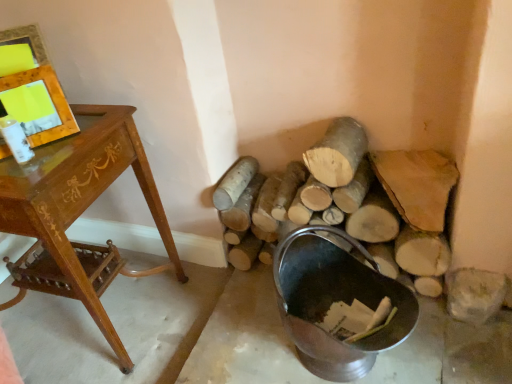
Locate an element on the screen. This screenshot has width=512, height=384. wooden frame at upper left is located at coordinates (51, 99).

What do you see at coordinates (337, 152) in the screenshot?
I see `natural wood log at center, marked as the 2th log in a left-to-right arrangement` at bounding box center [337, 152].

Describe the element at coordinates (234, 183) in the screenshot. I see `natural wood log at center, marked as the 1th log in a left-to-right arrangement` at that location.

Find the location of a particular element. The image size is (512, 384). wooden frame at upper left is located at coordinates (51, 99).

From a real-world perspective, relative to wooden frame at upper left, is natural wood log at center, positioned as the 2th log in right-to-left order, vertically above or below?

Clearly, from a real-world perspective, natural wood log at center, positioned as the 2th log in right-to-left order, is below wooden frame at upper left.

Does natural wood log at center, marked as the 1th log in a left-to-right arrangement, have a greater height compared to wooden frame at upper left?

No, natural wood log at center, marked as the 1th log in a left-to-right arrangement, is not taller than wooden frame at upper left.

Is natural wood log at center, positioned as the 2th log in right-to-left order, directly adjacent to wooden frame at upper left?

No, natural wood log at center, positioned as the 2th log in right-to-left order, is not next to wooden frame at upper left.

Looking at their sizes, would you say natural wood log at center, marked as the 1th log in a left-to-right arrangement, is wider or thinner than wooden frame at upper left?

In the image, natural wood log at center, marked as the 1th log in a left-to-right arrangement, appears to be wider than wooden frame at upper left.

Considering the positions of objects natural wood log at center, positioned as the 2th log in right-to-left order, and natural wood log at center, arranged as the 1th log when viewed from the right, in the image provided, who is more to the left, natural wood log at center, positioned as the 2th log in right-to-left order, or natural wood log at center, arranged as the 1th log when viewed from the right,?

natural wood log at center, positioned as the 2th log in right-to-left order, is more to the left.

Does point (234, 165) lie in front of point (331, 135)?

No.

Is natural wood log at center, marked as the 1th log in a left-to-right arrangement, wider than natural wood log at center, arranged as the 1th log when viewed from the right?

Yes, natural wood log at center, marked as the 1th log in a left-to-right arrangement, is wider than natural wood log at center, arranged as the 1th log when viewed from the right.

From a real-world perspective, is metallic bucket at lower right physically below natural wood log at center, positioned as the 2th log in right-to-left order?

Correct, in the physical world, metallic bucket at lower right is lower than natural wood log at center, positioned as the 2th log in right-to-left order.

Is metallic bucket at lower right situated inside natural wood log at center, positioned as the 2th log in right-to-left order, or outside?

metallic bucket at lower right is spatially situated outside natural wood log at center, positioned as the 2th log in right-to-left order.

From the image's perspective, which object appears higher, metallic bucket at lower right or natural wood log at center, marked as the 1th log in a left-to-right arrangement?

natural wood log at center, marked as the 1th log in a left-to-right arrangement.

Considering the relative positions of metallic bucket at lower right and natural wood log at center, marked as the 1th log in a left-to-right arrangement, in the image provided, is metallic bucket at lower right to the right of natural wood log at center, marked as the 1th log in a left-to-right arrangement, from the viewer's perspective?

Yes.

Can you confirm if wooden frame at upper left is positioned to the left of natural wood log at center, marked as the 1th log in a left-to-right arrangement?

Yes.

Considering the sizes of wooden frame at upper left and natural wood log at center, positioned as the 2th log in right-to-left order, in the image, is wooden frame at upper left taller or shorter than natural wood log at center, positioned as the 2th log in right-to-left order,?

In the image, wooden frame at upper left appears to be taller than natural wood log at center, positioned as the 2th log in right-to-left order.

Considering the sizes of wooden frame at upper left and natural wood log at center, positioned as the 2th log in right-to-left order, in the image, is wooden frame at upper left wider or thinner than natural wood log at center, positioned as the 2th log in right-to-left order,?

wooden frame at upper left is thinner than natural wood log at center, positioned as the 2th log in right-to-left order.

In the scene shown: Is the surface of natural wood log at center, marked as the 1th log in a left-to-right arrangement, in direct contact with metallic bucket at lower right?

No, natural wood log at center, marked as the 1th log in a left-to-right arrangement, is not next to metallic bucket at lower right.

From the image's perspective, between natural wood log at center, positioned as the 2th log in right-to-left order, and metallic bucket at lower right, who is located below?

metallic bucket at lower right appears lower in the image.

Where is `basin lying on the right of natural wood log at center, marked as the 1th log in a left-to-right arrangement`? This screenshot has width=512, height=384. basin lying on the right of natural wood log at center, marked as the 1th log in a left-to-right arrangement is located at coordinates (335, 301).

Considering the sizes of objects natural wood log at center, marked as the 1th log in a left-to-right arrangement, and metallic bucket at lower right in the image provided, who is thinner, natural wood log at center, marked as the 1th log in a left-to-right arrangement, or metallic bucket at lower right?

natural wood log at center, marked as the 1th log in a left-to-right arrangement, is thinner.

Which object is closer to the camera taking this photo, wooden desk at left or metallic bucket at lower right?

wooden desk at left is more forward.

Which of these two, wooden desk at left or metallic bucket at lower right, is bigger?

Bigger between the two is wooden desk at left.

Looking at this image, is wooden desk at left positioned beyond the bounds of metallic bucket at lower right?

Yes, wooden desk at left is located beyond the bounds of metallic bucket at lower right.

This screenshot has height=384, width=512. Find the location of `basin below the wooden desk at left (from a real-world perspective)`. basin below the wooden desk at left (from a real-world perspective) is located at coordinates (335, 301).

Which object is wider, wooden frame at upper left or metallic bucket at lower right?

metallic bucket at lower right.

Is metallic bucket at lower right inside wooden frame at upper left?

Actually, metallic bucket at lower right is outside wooden frame at upper left.

Is wooden frame at upper left bigger or smaller than metallic bucket at lower right?

wooden frame at upper left is smaller than metallic bucket at lower right.

Locate an element on the screen. picture frame that appears on the left of natural wood log at center, positioned as the 2th log in right-to-left order is located at coordinates (51, 99).

This screenshot has height=384, width=512. I want to click on log directly beneath the natural wood log at center, arranged as the 1th log when viewed from the right (from a real-world perspective), so (x=234, y=183).

Considering their positions, is metallic bucket at lower right positioned further to natural wood log at center, arranged as the 1th log when viewed from the right, than wooden desk at left?

The object further to natural wood log at center, arranged as the 1th log when viewed from the right, is wooden desk at left.

Considering their positions, is wooden frame at upper left positioned closer to metallic bucket at lower right than wooden desk at left?

wooden desk at left is closer to metallic bucket at lower right.

Looking at this image, considering their positions, is wooden desk at left positioned further to natural wood log at center, positioned as the 2th log in right-to-left order, than natural wood log at center, marked as the 2th log in a left-to-right arrangement?

Based on the image, wooden desk at left appears to be further to natural wood log at center, positioned as the 2th log in right-to-left order.

Based on their spatial positions, is natural wood log at center, marked as the 1th log in a left-to-right arrangement, or metallic bucket at lower right further from wooden desk at left?

The object further to wooden desk at left is metallic bucket at lower right.

Estimate the real-world distances between objects in this image. Which object is closer to natural wood log at center, positioned as the 2th log in right-to-left order, metallic bucket at lower right or wooden desk at left?

wooden desk at left is positioned closer to the anchor natural wood log at center, positioned as the 2th log in right-to-left order.

Which object lies further to the anchor point wooden desk at left, natural wood log at center, marked as the 2th log in a left-to-right arrangement, or metallic bucket at lower right?

natural wood log at center, marked as the 2th log in a left-to-right arrangement, lies further to wooden desk at left than the other object.

Considering their positions, is wooden desk at left positioned further to metallic bucket at lower right than natural wood log at center, marked as the 2th log in a left-to-right arrangement?

Among the two, wooden desk at left is located further to metallic bucket at lower right.

Based on their spatial positions, is wooden frame at upper left or natural wood log at center, positioned as the 2th log in right-to-left order, further from natural wood log at center, marked as the 2th log in a left-to-right arrangement?

wooden frame at upper left is positioned further to the anchor natural wood log at center, marked as the 2th log in a left-to-right arrangement.

In order to click on basin between wooden frame at upper left and natural wood log at center, marked as the 2th log in a left-to-right arrangement, in the horizontal direction in this screenshot , I will do `click(335, 301)`.

Locate an element on the screen. The width and height of the screenshot is (512, 384). log located between wooden desk at left and metallic bucket at lower right in the left-right direction is located at coordinates (234, 183).

What are the coordinates of `picture frame between wooden desk at left and natural wood log at center, marked as the 2th log in a left-to-right arrangement` in the screenshot? It's located at (51, 99).

The height and width of the screenshot is (384, 512). Find the location of `log between wooden frame at upper left and metallic bucket at lower right in the horizontal direction`. log between wooden frame at upper left and metallic bucket at lower right in the horizontal direction is located at coordinates (x=234, y=183).